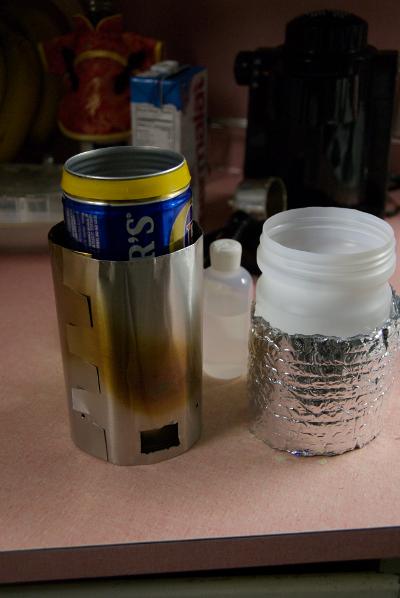
Locate an element on the screen. The height and width of the screenshot is (598, 400). box container is located at coordinates (167, 109).